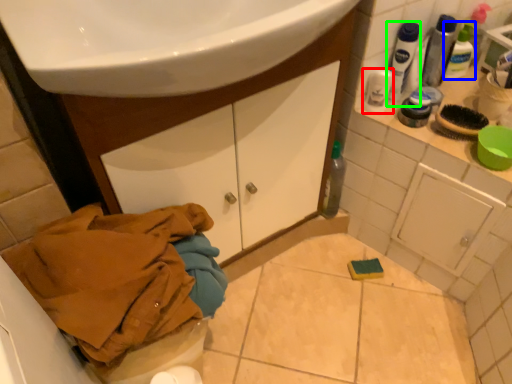
Question: Which object is the farthest from mouthwash (highlighted by a red box)? Choose among these: mouthwash (highlighted by a blue box) or mouthwash (highlighted by a green box).

Choices:
 (A) mouthwash
 (B) mouthwash

Answer: (A)